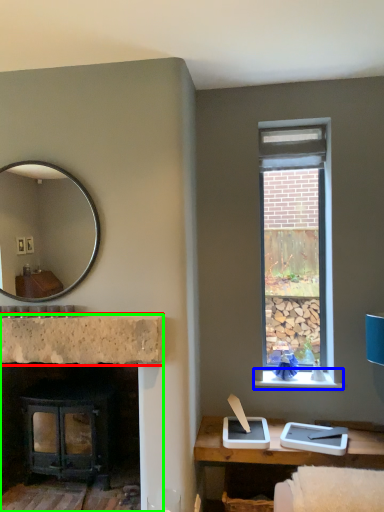
Question: Which object is positioned farthest from counter top (highlighted by a red box)? Select from window sill (highlighted by a blue box) and fireplace (highlighted by a green box).

Choices:
 (A) window sill
 (B) fireplace

Answer: (A)